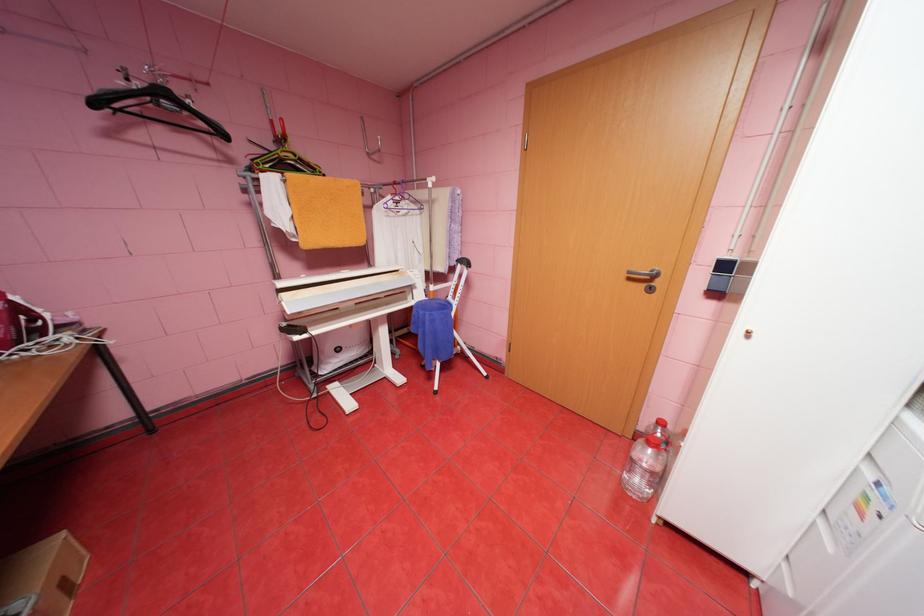
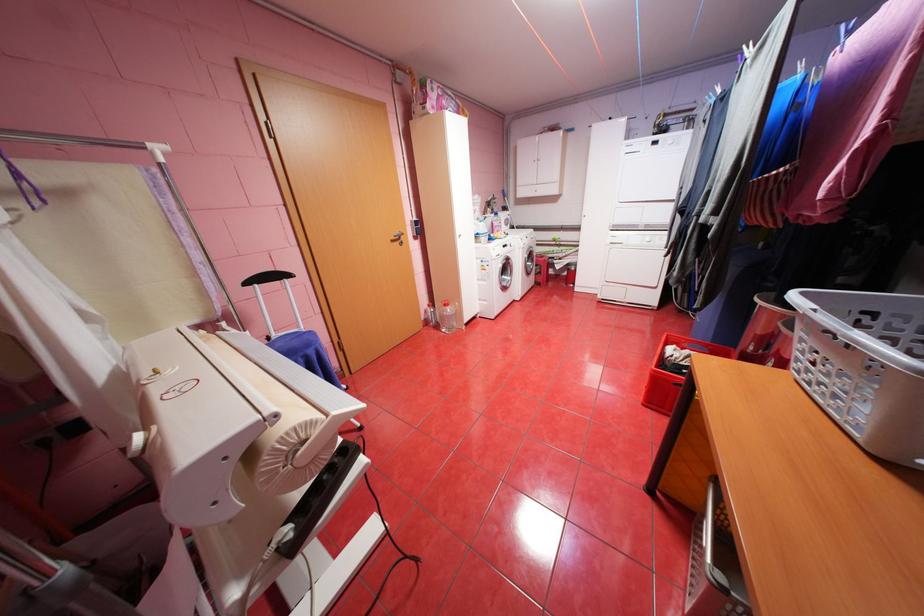
The point at (638, 278) is marked in the first image. Where is the corresponding point in the second image?

(400, 241)